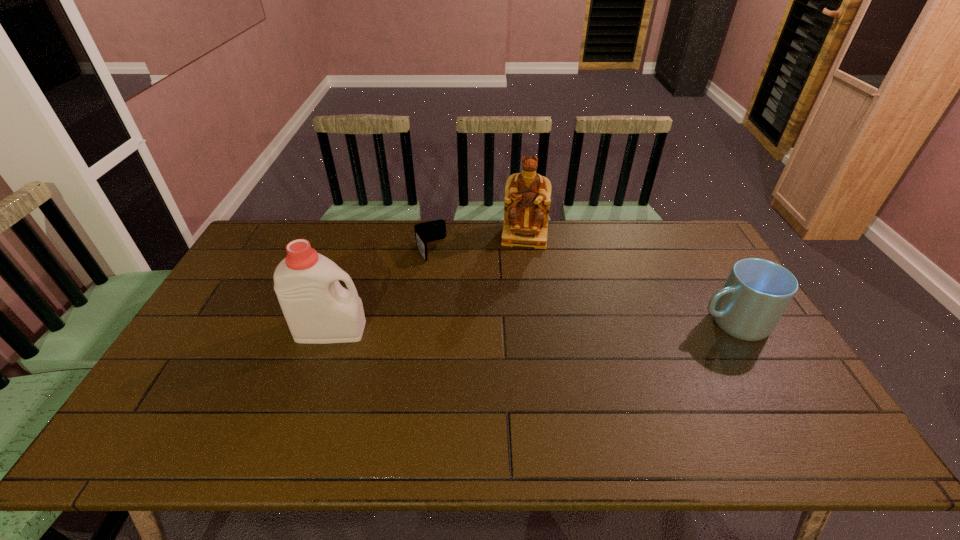
You are a GUI agent. You are given a task and a screenshot of the screen. Output one action in this format:
    pyautogui.click(x=<x>, y=<y>)
    Task: Click on the detergent
    Image resolution: width=960 pixels, height=540 pixels.
    Given the screenshot: What is the action you would take?
    pyautogui.click(x=318, y=309)

Where is `the third tallest object`? The height and width of the screenshot is (540, 960). the third tallest object is located at coordinates (757, 292).

This screenshot has width=960, height=540. I want to click on the rightmost object, so tap(757, 292).

This screenshot has height=540, width=960. I want to click on the third object from left to right, so click(527, 200).

The image size is (960, 540). Identify the location of the second object from left to right. (429, 231).

Where is `the shortest object`? the shortest object is located at coordinates (429, 231).

You are a GUI agent. You are given a task and a screenshot of the screen. Output one action in this format:
    pyautogui.click(x=<x>, y=<y>)
    Task: Click on the vacant space located on the handle side of the detergent
    
    Given the screenshot: What is the action you would take?
    pyautogui.click(x=412, y=330)

The height and width of the screenshot is (540, 960). What are the coordinates of `vacant space positioned 0.100m on the back of the mug` in the screenshot? It's located at (708, 281).

The image size is (960, 540). I want to click on free location located 0.320m on the front-facing side of the second object from right to left, so click(515, 314).

Image resolution: width=960 pixels, height=540 pixels. I want to click on vacant space located on the front-facing side of the second object from right to left, so click(514, 321).